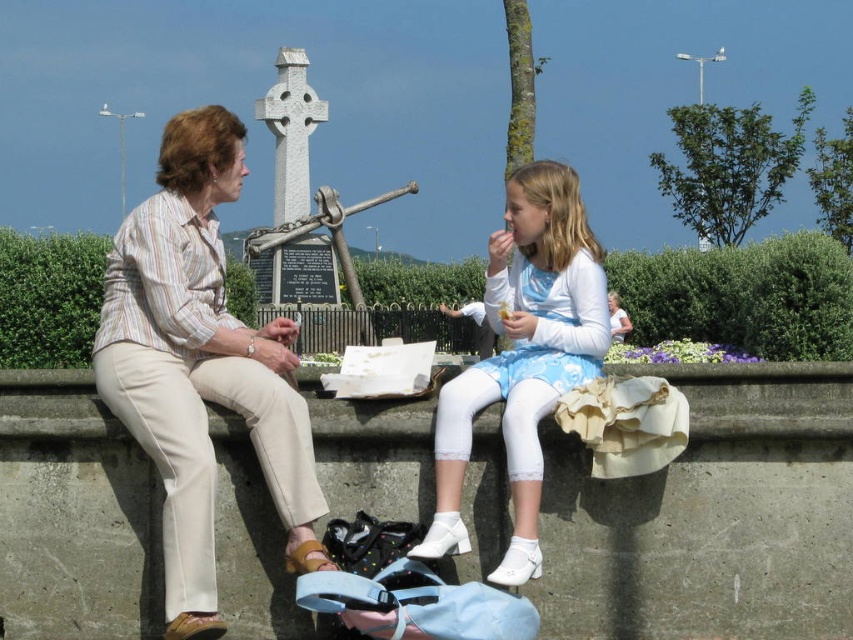
Can you confirm if green leafy hedge at center is thinner than white lace leggings at center?

Incorrect, green leafy hedge at center's width is not less than white lace leggings at center's.

What do you see at coordinates (743, 296) in the screenshot?
I see `green leafy hedge at center` at bounding box center [743, 296].

Which is in front, point (846, 353) or point (552, 330)?

Positioned in front is point (552, 330).

Locate an element on the screen. green leafy hedge at center is located at coordinates (743, 296).

Is point (520, 467) behind point (616, 314)?

No.

You are a GUI agent. You are given a task and a screenshot of the screen. Output one action in this format:
    pyautogui.click(x=<x>, y=<y>)
    Task: Click on the white lace leggings at center
    
    Given the screenshot: What is the action you would take?
    pyautogui.click(x=523, y=356)

Locate an element on the screen. The image size is (853, 640). green leafy hedge at center is located at coordinates (743, 296).

Between green leafy hedge at center and light blue denim dress at center, which one appears on the right side from the viewer's perspective?

light blue denim dress at center is more to the right.

The image size is (853, 640). What do you see at coordinates (743, 296) in the screenshot?
I see `green leafy hedge at center` at bounding box center [743, 296].

Identify the location of green leafy hedge at center. This screenshot has height=640, width=853. (743, 296).